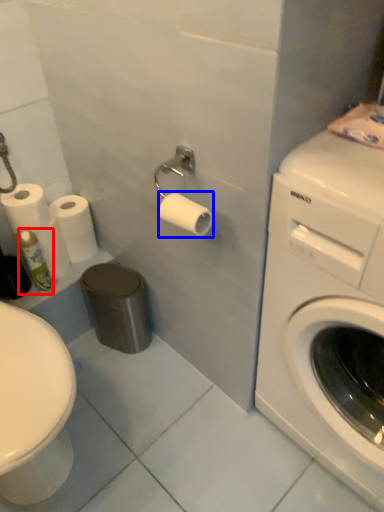
Question: Which of the following is the farthest to the observer, toiletry (highlighted by a red box) or toilet paper (highlighted by a blue box)?

Choices:
 (A) toiletry
 (B) toilet paper

Answer: (A)